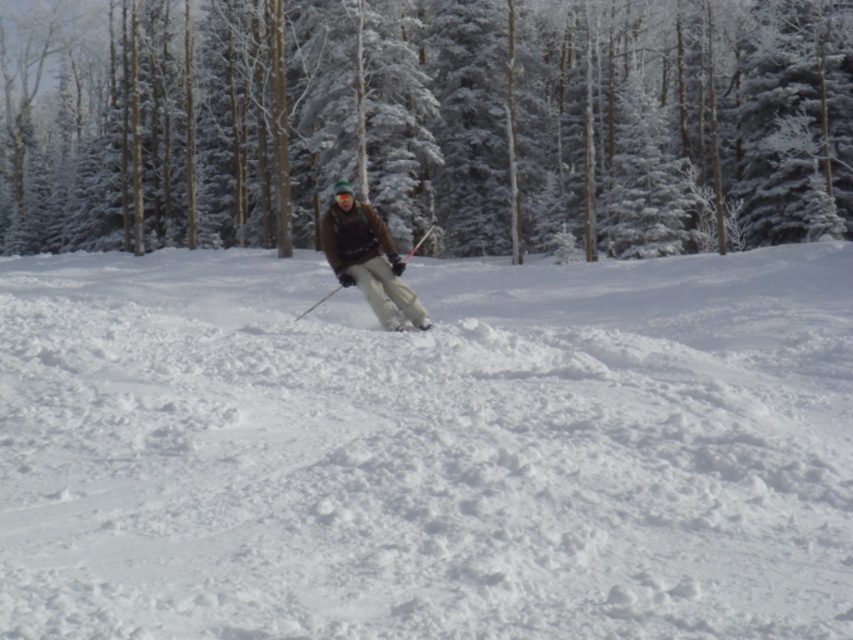
Question: Which of the following is the farthest from the observer?

Choices:
 (A) snowy evergreen tree at center
 (B) green fuzzy goggles at center
 (C) white fluffy snow at center

Answer: (A)

Question: Does white fluffy snow at center appear under white matte ski at center?

Choices:
 (A) yes
 (B) no

Answer: (B)

Question: Which is farther from the green fuzzy goggles at center?

Choices:
 (A) snowy evergreen tree at center
 (B) white fluffy snow at center

Answer: (A)

Question: Which of the following is the farthest from the observer?

Choices:
 (A) (410, 323)
 (B) (444, 369)

Answer: (A)

Question: Does white fluffy snow at center have a greater width compared to white matte ski at center?

Choices:
 (A) no
 (B) yes

Answer: (B)

Question: Is white fluffy snow at center to the right of green fuzzy goggles at center from the viewer's perspective?

Choices:
 (A) no
 (B) yes

Answer: (B)